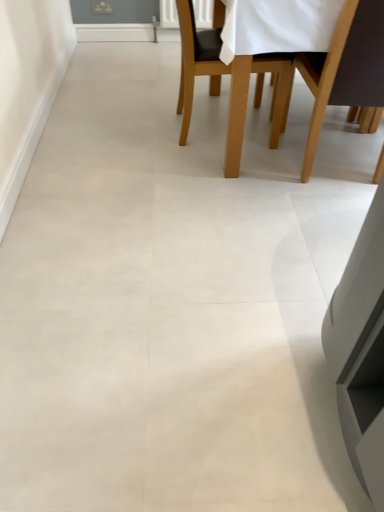
Find the location of a particular element. This screenshot has height=512, width=384. vacant position to the left of light brown wooden chair at upper center, which appears as the 1th chair when viewed from the left is located at coordinates (137, 124).